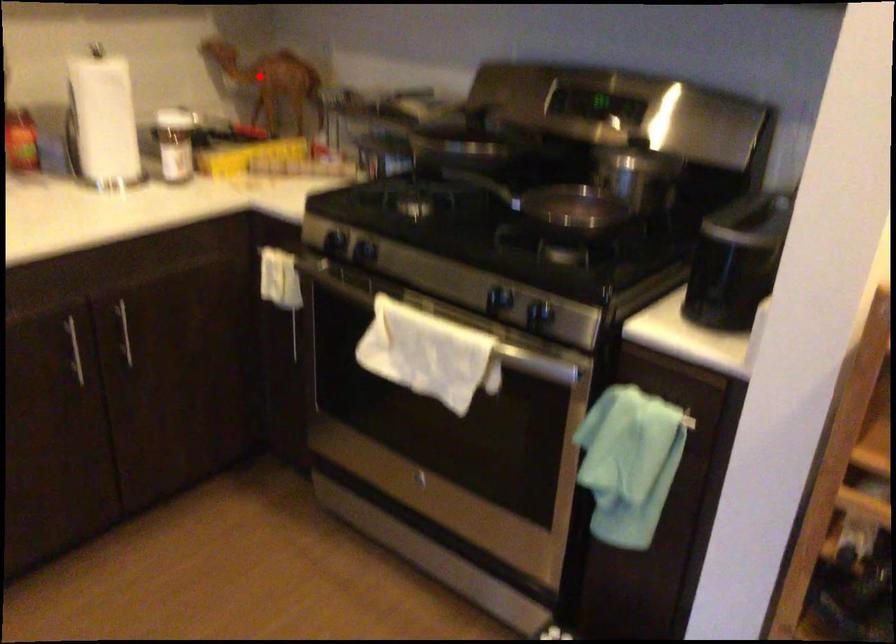
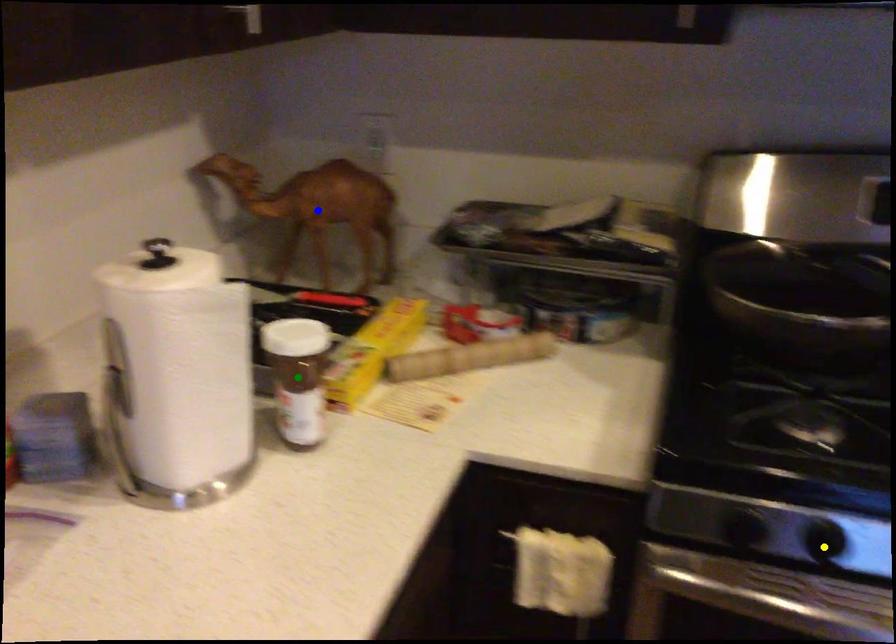
Question: I am providing you with two images of the same scene from different viewpoints. A red point is marked on the first image. You are given multiple points on the second image. Can you choose the point in image 2 that corresponds to the point in image 1?

Choices:
 (A) yellow point
 (B) blue point
 (C) green point

Answer: (B)